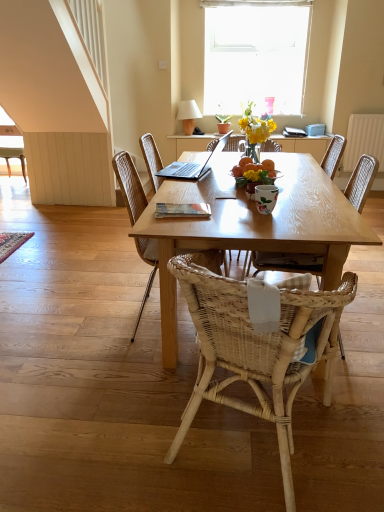
The width and height of the screenshot is (384, 512). Find the location of `free region on the left part of woven wood chair at center, placed as the second chair when sorted from right to left`. free region on the left part of woven wood chair at center, placed as the second chair when sorted from right to left is located at coordinates (113, 420).